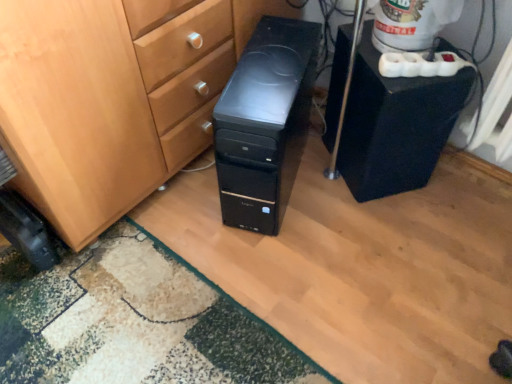
Question: Is green textured rug at lower left far from black plastic speaker at right?

Choices:
 (A) yes
 (B) no

Answer: (B)

Question: Considering the relative sizes of green textured rug at lower left and black plastic speaker at right in the image provided, is green textured rug at lower left wider than black plastic speaker at right?

Choices:
 (A) yes
 (B) no

Answer: (A)

Question: Is green textured rug at lower left not inside black plastic speaker at right?

Choices:
 (A) yes
 (B) no

Answer: (A)

Question: Can you confirm if green textured rug at lower left is bigger than black plastic speaker at right?

Choices:
 (A) yes
 (B) no

Answer: (B)

Question: Is green textured rug at lower left oriented towards black plastic speaker at right?

Choices:
 (A) no
 (B) yes

Answer: (A)

Question: Is green textured rug at lower left positioned with its back to black plastic speaker at right?

Choices:
 (A) yes
 (B) no

Answer: (B)

Question: Is black plastic speaker at right not close to black plastic computer tower at center?

Choices:
 (A) yes
 (B) no

Answer: (B)

Question: From the image's perspective, does black plastic speaker at right appear lower than black plastic computer tower at center?

Choices:
 (A) yes
 (B) no

Answer: (B)

Question: Is black plastic speaker at right positioned with its back to black plastic computer tower at center?

Choices:
 (A) yes
 (B) no

Answer: (B)

Question: Considering the relative positions of black plastic speaker at right and black plastic computer tower at center in the image provided, is black plastic speaker at right to the right of black plastic computer tower at center from the viewer's perspective?

Choices:
 (A) yes
 (B) no

Answer: (A)

Question: Is black plastic speaker at right thinner than black plastic computer tower at center?

Choices:
 (A) yes
 (B) no

Answer: (A)

Question: From a real-world perspective, is black plastic speaker at right physically above black plastic computer tower at center?

Choices:
 (A) yes
 (B) no

Answer: (B)

Question: Is black plastic speaker at right positioned far away from black rubber wheel at lower left?

Choices:
 (A) no
 (B) yes

Answer: (A)